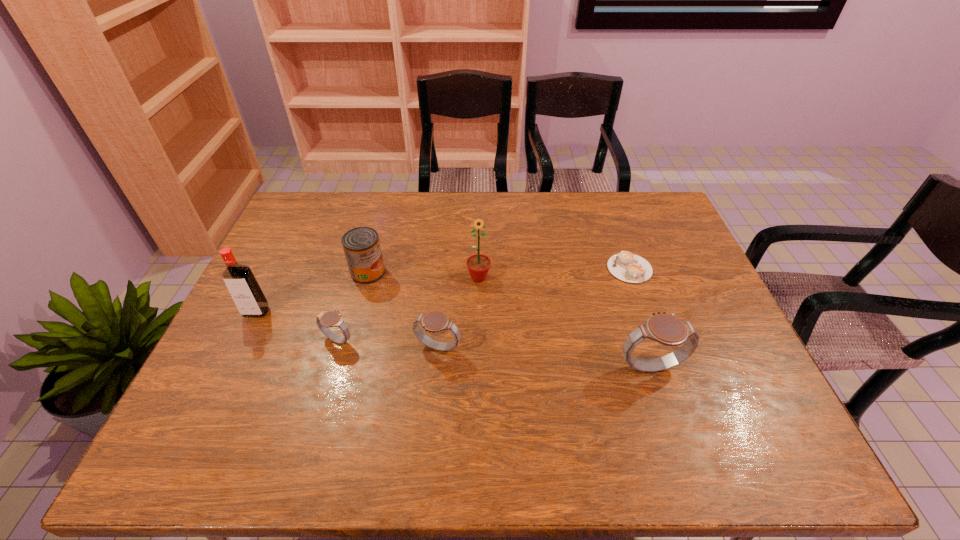
Identify the location of the shortest watch. (324, 320).

The height and width of the screenshot is (540, 960). I want to click on the leftmost watch, so click(x=324, y=320).

I want to click on the second tallest watch, so click(435, 321).

The height and width of the screenshot is (540, 960). Identify the location of the second watch from left to right. (435, 321).

Locate an element on the screen. the tallest watch is located at coordinates (666, 329).

Image resolution: width=960 pixels, height=540 pixels. I want to click on cappuccino, so click(x=628, y=267).

I want to click on the leftmost object, so click(245, 291).

What are the coordinates of `the fourth farthest object` in the screenshot? It's located at (245, 291).

Where is `sunflower`? sunflower is located at coordinates (478, 265).

Locate an element on the screen. the fourth shortest object is located at coordinates (361, 245).